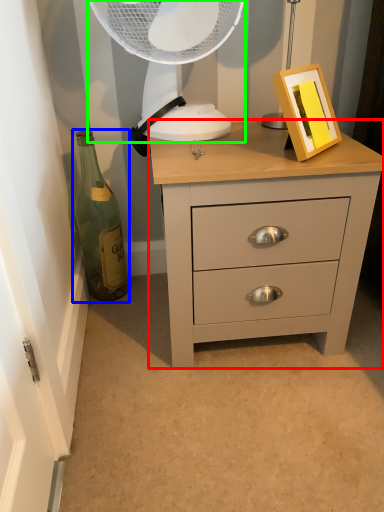
Question: Which object is positioned closest to chest of drawers (highlighted by a red box)? Select from bottle (highlighted by a blue box) and mechanical fan (highlighted by a green box).

Choices:
 (A) bottle
 (B) mechanical fan

Answer: (B)